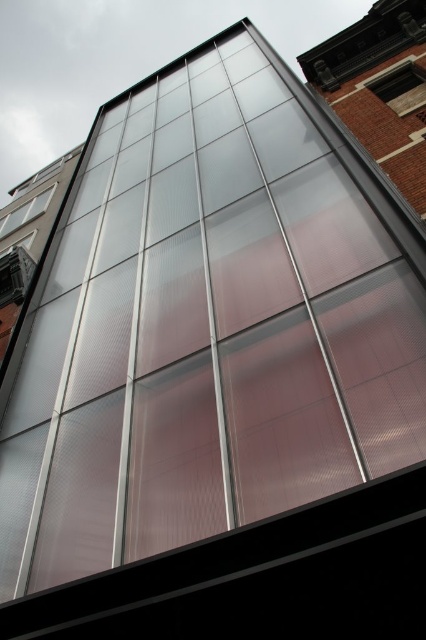
Looking at this image, does clear glass window at upper right appear on the left side of clear glass window at upper left?

No, clear glass window at upper right is not to the left of clear glass window at upper left.

Describe the element at coordinates (400, 88) in the screenshot. The height and width of the screenshot is (640, 426). I see `clear glass window at upper right` at that location.

This screenshot has width=426, height=640. In order to click on clear glass window at upper right in this screenshot , I will do `click(400, 88)`.